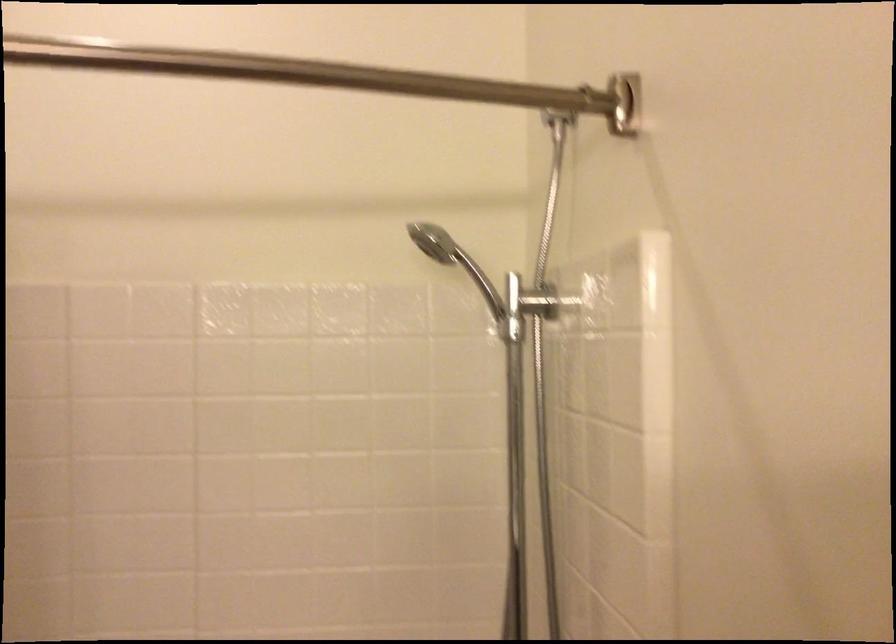
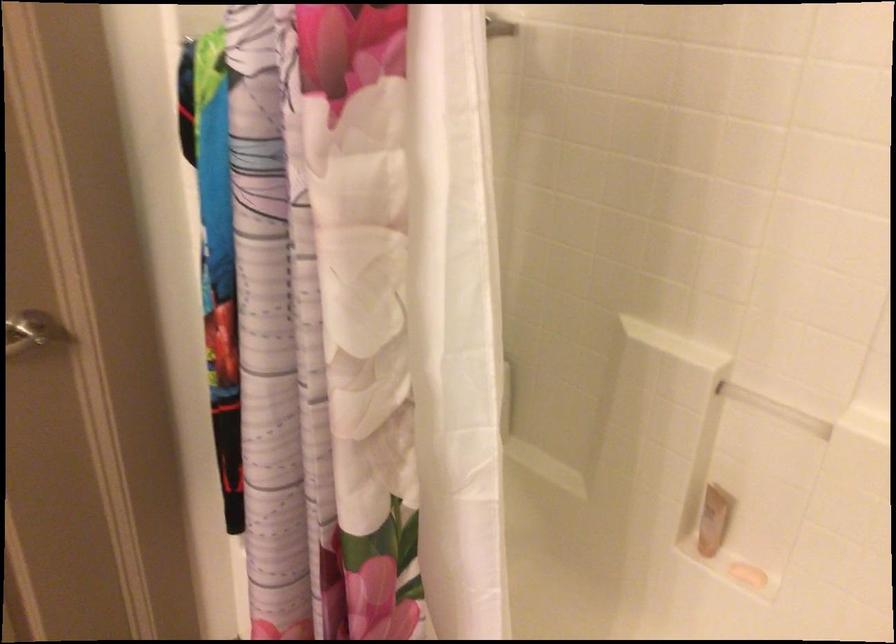
The images are taken continuously from a first-person perspective. In which direction is your viewpoint rotating?

The rotation direction of the camera is left-down.